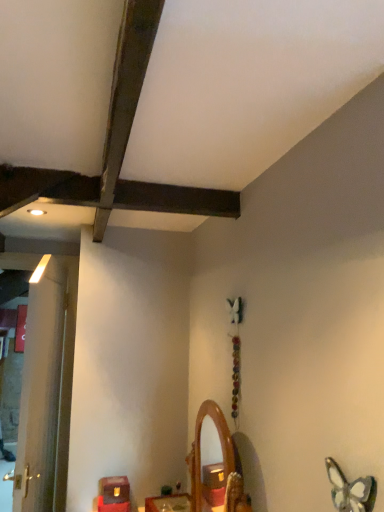
Question: Considering the relative sizes of translucent glass butterfly at lower right and matte brown wooden box at lower left, the 1th furniture from the left, in the image provided, is translucent glass butterfly at lower right wider than matte brown wooden box at lower left, the 1th furniture from the left,?

Choices:
 (A) yes
 (B) no

Answer: (B)

Question: Is translucent glass butterfly at lower right bigger than matte brown wooden box at lower left, the 1th furniture from the left?

Choices:
 (A) no
 (B) yes

Answer: (A)

Question: Is translucent glass butterfly at lower right aimed at matte brown wooden box at lower left, the 1th furniture from the left?

Choices:
 (A) yes
 (B) no

Answer: (B)

Question: Is translucent glass butterfly at lower right further to the viewer compared to matte brown wooden box at lower left, the 1th furniture from the left?

Choices:
 (A) no
 (B) yes

Answer: (A)

Question: From the image's perspective, would you say translucent glass butterfly at lower right is positioned over matte brown wooden box at lower left, the second furniture in the right-to-left sequence?

Choices:
 (A) no
 (B) yes

Answer: (B)

Question: Is translucent glass butterfly at lower right to the right of matte brown wooden box at lower left, the 1th furniture from the left, from the viewer's perspective?

Choices:
 (A) no
 (B) yes

Answer: (B)

Question: Can wooden mirror at center be found inside matte brown wooden box at lower left, the 1th furniture from the left?

Choices:
 (A) no
 (B) yes

Answer: (A)

Question: Considering the relative sizes of matte brown wooden box at lower left, the 1th furniture from the left, and wooden mirror at center in the image provided, is matte brown wooden box at lower left, the 1th furniture from the left, taller than wooden mirror at center?

Choices:
 (A) no
 (B) yes

Answer: (A)

Question: Is matte brown wooden box at lower left, the 1th furniture from the left, shorter than wooden mirror at center?

Choices:
 (A) yes
 (B) no

Answer: (A)

Question: From the image's perspective, does matte brown wooden box at lower left, the 1th furniture from the left, appear lower than wooden mirror at center?

Choices:
 (A) no
 (B) yes

Answer: (B)

Question: From the image's perspective, does matte brown wooden box at lower left, the second furniture in the right-to-left sequence, appear higher than wooden mirror at center?

Choices:
 (A) yes
 (B) no

Answer: (B)

Question: Does matte brown wooden box at lower left, the second furniture in the right-to-left sequence, have a lesser width compared to wooden mirror at center?

Choices:
 (A) no
 (B) yes

Answer: (A)

Question: Is matte brown wooden box at lower left, the second furniture in the right-to-left sequence, smaller than wooden mirror at center, the second furniture when ordered from left to right?

Choices:
 (A) no
 (B) yes

Answer: (B)